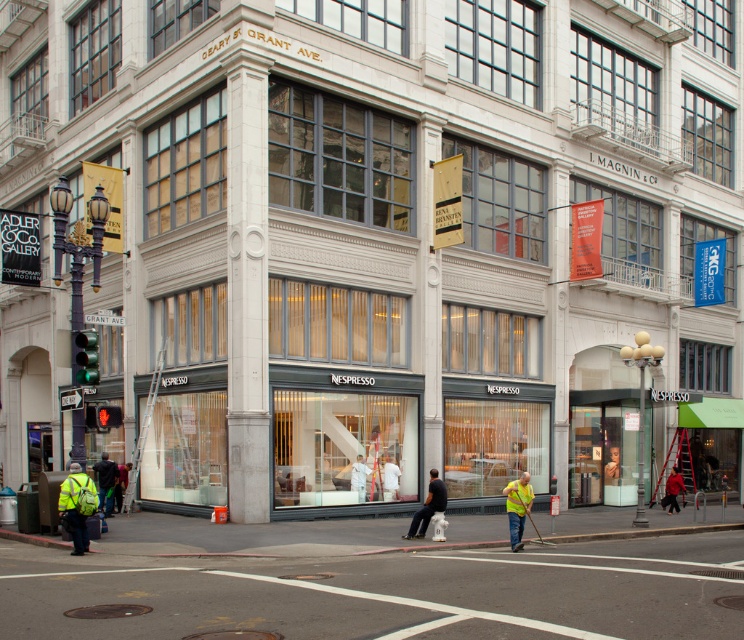
Who is taller, reflective yellow safety vest at lower left or yellow reflective vest at lower right?

Standing taller between the two is yellow reflective vest at lower right.

Is point (74, 515) more distant than point (519, 540)?

No, (74, 515) is in front of (519, 540).

Is point (67, 500) closer to camera compared to point (519, 536)?

Yes, point (67, 500) is in front of point (519, 536).

The image size is (744, 640). I want to click on reflective yellow safety vest at lower left, so click(77, 506).

Does point (442, 499) lie in front of point (673, 467)?

Yes, it is in front of point (673, 467).

Can you confirm if light brown leather jacket at lower center is positioned above red fabric jacket at lower right?

Yes, light brown leather jacket at lower center is above red fabric jacket at lower right.

Does point (439, 481) lie in front of point (670, 506)?

Yes, it is.

You are a GUI agent. You are given a task and a screenshot of the screen. Output one action in this format:
    pyautogui.click(x=<x>, y=<y>)
    Task: Click on the light brown leather jacket at lower center
    The width and height of the screenshot is (744, 640).
    Given the screenshot: What is the action you would take?
    pyautogui.click(x=426, y=506)

Is point (565, 616) behind point (673, 476)?

No, it is in front of (673, 476).

Which of these two, smooth asphalt road at center or red fabric jacket at lower right, stands taller?

smooth asphalt road at center

Is point (490, 557) farther from camera compared to point (676, 468)?

No, it is in front of (676, 468).

Find the location of a particular element. smooth asphalt road at center is located at coordinates (385, 593).